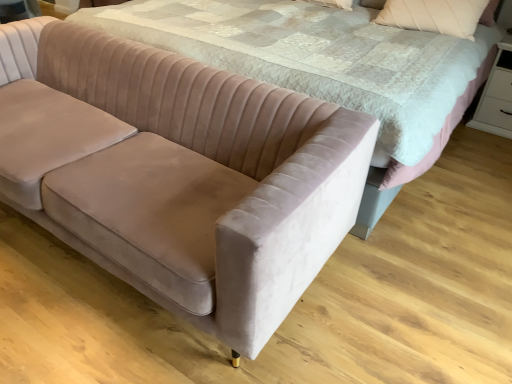
Question: From the image's perspective, is velvet beige couch at lower left beneath white glossy dresser at lower right?

Choices:
 (A) no
 (B) yes

Answer: (B)

Question: Does velvet beige couch at lower left have a larger size compared to white glossy dresser at lower right?

Choices:
 (A) yes
 (B) no

Answer: (A)

Question: Is velvet beige couch at lower left outside white glossy dresser at lower right?

Choices:
 (A) yes
 (B) no

Answer: (A)

Question: Is velvet beige couch at lower left not close to white glossy dresser at lower right?

Choices:
 (A) no
 (B) yes

Answer: (B)

Question: Is velvet beige couch at lower left oriented towards white glossy dresser at lower right?

Choices:
 (A) yes
 (B) no

Answer: (B)

Question: Is white glossy dresser at lower right at the back of velvet beige couch at lower left?

Choices:
 (A) no
 (B) yes

Answer: (B)

Question: Can you confirm if velvet beige pillow at upper right is positioned to the left of white glossy dresser at lower right?

Choices:
 (A) no
 (B) yes

Answer: (B)

Question: Does velvet beige pillow at upper right lie in front of white glossy dresser at lower right?

Choices:
 (A) no
 (B) yes

Answer: (B)

Question: Are velvet beige pillow at upper right and white glossy dresser at lower right far apart?

Choices:
 (A) yes
 (B) no

Answer: (B)

Question: Is velvet beige pillow at upper right wider than white glossy dresser at lower right?

Choices:
 (A) no
 (B) yes

Answer: (A)

Question: Considering the relative sizes of velvet beige pillow at upper right and white glossy dresser at lower right in the image provided, is velvet beige pillow at upper right smaller than white glossy dresser at lower right?

Choices:
 (A) yes
 (B) no

Answer: (A)

Question: From a real-world perspective, is velvet beige pillow at upper right below white glossy dresser at lower right?

Choices:
 (A) no
 (B) yes

Answer: (A)

Question: Is white glossy dresser at lower right outside of velvet pink bed at center?

Choices:
 (A) yes
 (B) no

Answer: (A)